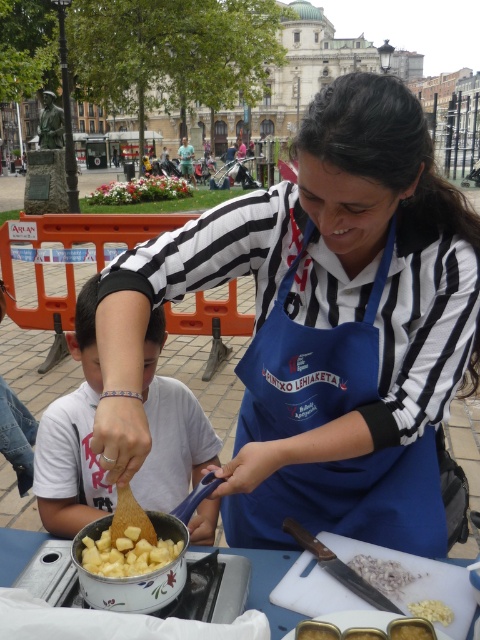
Can you confirm if white crumbly food at lower center is wider than white rubber garlic at center?

Correct, the width of white crumbly food at lower center exceeds that of white rubber garlic at center.

Is white crumbly food at lower center below white rubber garlic at center?

No, white crumbly food at lower center is not below white rubber garlic at center.

Image resolution: width=480 pixels, height=640 pixels. Describe the element at coordinates (383, 573) in the screenshot. I see `white crumbly food at lower center` at that location.

Image resolution: width=480 pixels, height=640 pixels. What are the coordinates of `white crumbly food at lower center` in the screenshot? It's located at (383, 573).

The image size is (480, 640). Describe the element at coordinates (268, 586) in the screenshot. I see `white ceramic pot at center` at that location.

Can you confirm if white ceramic pot at center is positioned below white rubber garlic at center?

No, white ceramic pot at center is not below white rubber garlic at center.

The image size is (480, 640). I want to click on white ceramic pot at center, so click(x=268, y=586).

Between blue fabric apron at center and white rubber garlic at center, which one appears on the right side from the viewer's perspective?

white rubber garlic at center

Does point (371, 333) come farther from viewer compared to point (429, 609)?

Yes, point (371, 333) is behind point (429, 609).

Where is `blue fabric apron at center`? This screenshot has height=640, width=480. blue fabric apron at center is located at coordinates pyautogui.click(x=348, y=500).